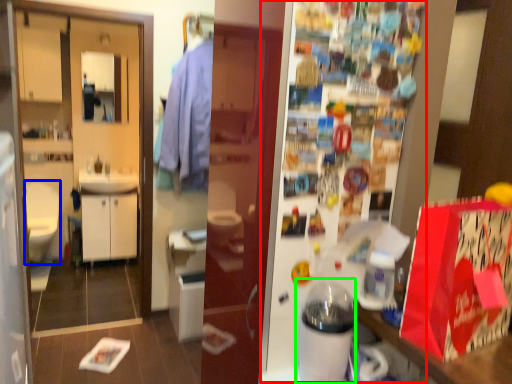
Question: Estimate the real-world distances between objects in this image. Which object is closer to fridge (highlighted by a red box), sit (highlighted by a blue box) or appliance (highlighted by a green box)?

Choices:
 (A) sit
 (B) appliance

Answer: (B)